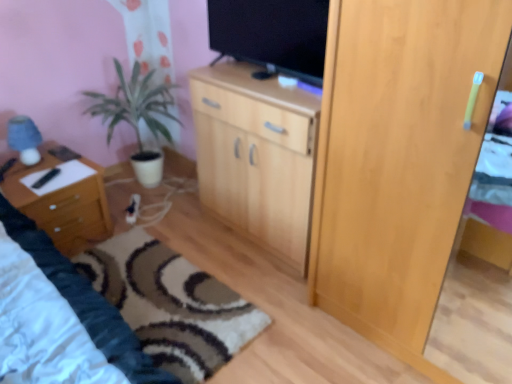
Image resolution: width=512 pixels, height=384 pixels. I want to click on free space in front of wooden cabinet at center, so click(x=274, y=290).